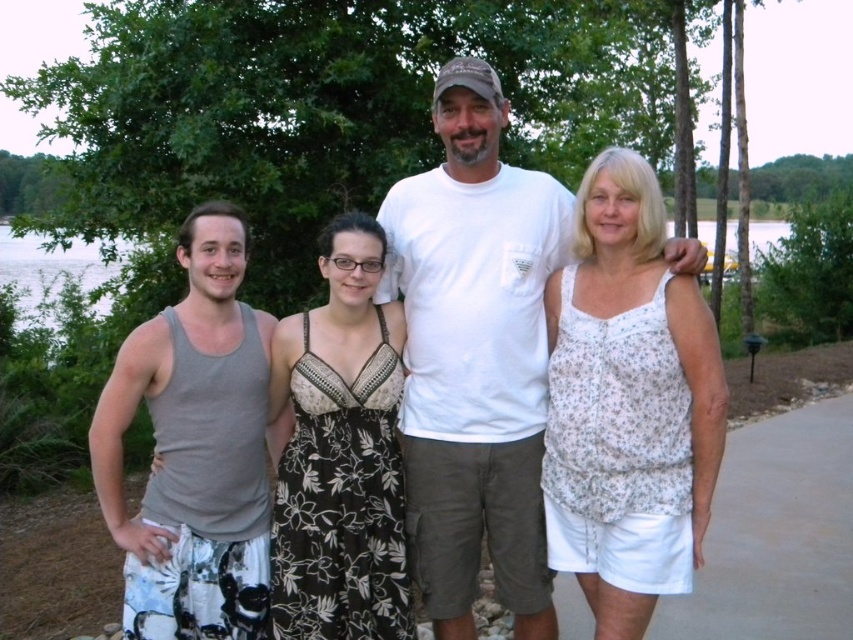
Does gray fabric tank top at left appear on the right side of transparent water at left?

Result: Yes, gray fabric tank top at left is to the right of transparent water at left.

From the picture: Does gray fabric tank top at left have a smaller size compared to transparent water at left?

Yes, gray fabric tank top at left is smaller than transparent water at left.

Measure the distance between point (173, 515) and camera.

They are 10.07 feet apart.

The image size is (853, 640). Identify the location of gray fabric tank top at left. (194, 449).

Can you confirm if black floral dress at center is positioned to the right of transparent water at left?

Correct, you'll find black floral dress at center to the right of transparent water at left.

Between black floral dress at center and transparent water at left, which one has less height?

black floral dress at center

Where is `black floral dress at center`? Image resolution: width=853 pixels, height=640 pixels. black floral dress at center is located at coordinates (341, 452).

Which of these two, white cotton t-shirt at center or gray fabric tank top at left, stands taller?

Standing taller between the two is white cotton t-shirt at center.

Does white cotton t-shirt at center have a larger size compared to gray fabric tank top at left?

Yes.

Is point (387, 220) positioned in front of point (229, 332)?

No, (387, 220) is further to viewer.

At what (x,y) coordinates should I click in order to perform the action: click on white cotton t-shirt at center. Please return your answer as a coordinate pair (x, y). This screenshot has width=853, height=640. Looking at the image, I should click on (474, 356).